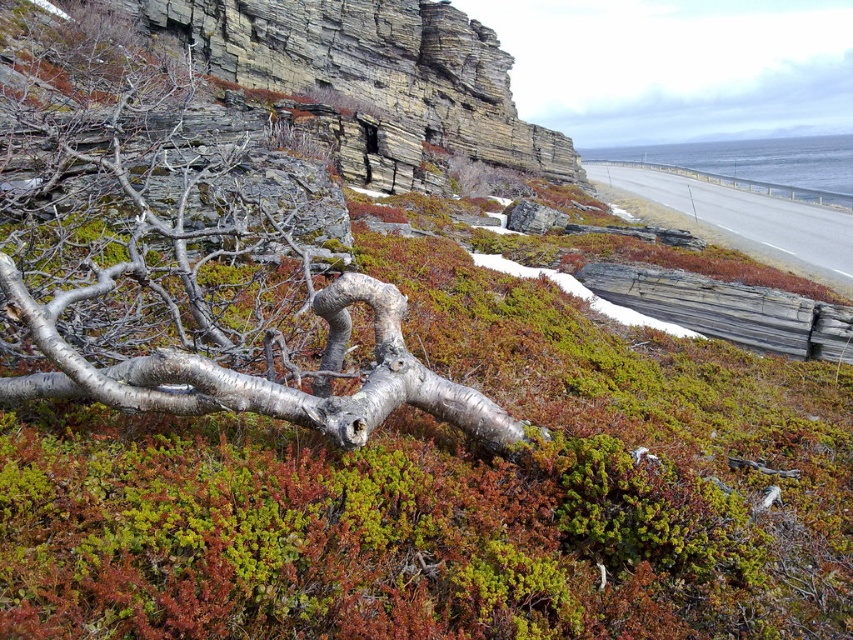
You are standing at the base of the rocky cliff on the left and want to reach the green mossy shrubs at center. Which direction should you move relative to the cliff?

The green mossy shrubs at center is located at point coordinates, so you should move towards the center of the image from the cliff on the left to reach them.

You are a hiker trying to cross the rugged coastal landscape. You see the silver metallic branch at center and the asphalt road at upper right. How far apart are these two landmarks?

The silver metallic branch at center and asphalt road at upper right are 26.78 meters apart from each other.

You are a hiker who has just arrived at this coastal area. You need to locate the silver metallic branch at center to mark your starting point. According to the coordinates provided, where exactly should you look to find it?

The silver metallic branch at center is located at the coordinates point (192, 273).